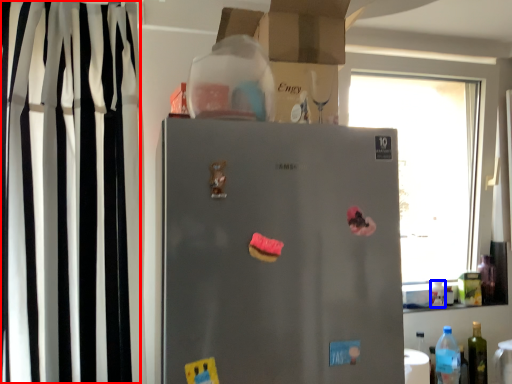
Question: Among these objects, which one is nearest to the camera, curtain (highlighted by a red box) or bottle (highlighted by a blue box)?

Choices:
 (A) curtain
 (B) bottle

Answer: (A)